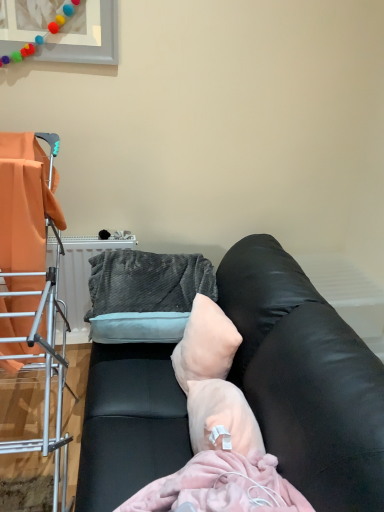
What do you see at coordinates (305, 378) in the screenshot?
I see `black leather couch at center` at bounding box center [305, 378].

You are a GUI agent. You are given a task and a screenshot of the screen. Output one action in this format:
    pyautogui.click(x=<x>, y=<y>)
    Task: Click on the black leather couch at center
    Image resolution: width=384 pixels, height=512 pixels.
    Given the screenshot: What is the action you would take?
    pyautogui.click(x=305, y=378)

The height and width of the screenshot is (512, 384). I want to click on pale pink fabric pillow at center, so click(x=205, y=344).

From a real-world perspective, is pale pink fabric pillow at center on black leather couch at center?

Correct, in the physical world, pale pink fabric pillow at center is higher than black leather couch at center.

Is pale pink fabric pillow at center touching black leather couch at center?

There is a gap between pale pink fabric pillow at center and black leather couch at center.

Could you tell me if pale pink fabric pillow at center is turned towards metal drying rack at left?

Yes, pale pink fabric pillow at center is aimed at metal drying rack at left.

Between pale pink fabric pillow at center and metal drying rack at left, which one has more height?

metal drying rack at left.

Is there a large distance between pale pink fabric pillow at center and metal drying rack at left?

That's not correct — pale pink fabric pillow at center is a little close to metal drying rack at left.

Does pale pink fabric pillow at center have a smaller size compared to metal drying rack at left?

Correct, pale pink fabric pillow at center occupies less space than metal drying rack at left.

From the image's perspective, would you say velvety gray bean bag chair at center is shown under pale pink fabric pillow at center?

No, from the image's perspective, velvety gray bean bag chair at center is not below pale pink fabric pillow at center.

Is pale pink fabric pillow at center at the back of velvety gray bean bag chair at center?

No, velvety gray bean bag chair at center's orientation is not away from pale pink fabric pillow at center.

Looking at the image, does velvety gray bean bag chair at center seem bigger or smaller compared to pale pink fabric pillow at center?

Clearly, velvety gray bean bag chair at center is larger in size than pale pink fabric pillow at center.

In the image, there is a velvety gray bean bag chair at center. At what (x,y) coordinates should I click in order to perform the action: click on pillow below it (from a real-world perspective). Please return your answer as a coordinate pair (x, y). Looking at the image, I should click on (205, 344).

From a real-world perspective, between black leather couch at center and pale pink fabric pillow at center, who is vertically higher?

pale pink fabric pillow at center is physically above.

Is black leather couch at center far away from pale pink fabric pillow at center?

No.

What's the angular difference between black leather couch at center and pale pink fabric pillow at center's facing directions?

15.6 degrees separate the facing orientations of black leather couch at center and pale pink fabric pillow at center.

Does black leather couch at center have a greater width compared to pale pink fabric pillow at center?

Correct, the width of black leather couch at center exceeds that of pale pink fabric pillow at center.

Is velvety gray bean bag chair at center positioned before black leather couch at center?

No, it is not.

How different are the orientations of velvety gray bean bag chair at center and black leather couch at center in degrees?

The facing directions of velvety gray bean bag chair at center and black leather couch at center are 0.000605 degrees apart.

Which of these two, velvety gray bean bag chair at center or black leather couch at center, is thinner?

Thinner between the two is velvety gray bean bag chair at center.

Is velvety gray bean bag chair at center situated inside black leather couch at center or outside?

velvety gray bean bag chair at center is enclosed within black leather couch at center.

Is pale pink fabric pillow at center positioned with its back to velvety gray bean bag chair at center?

pale pink fabric pillow at center does not have its back to velvety gray bean bag chair at center.

Which of these two, pale pink fabric pillow at center or velvety gray bean bag chair at center, stands shorter?

pale pink fabric pillow at center.

From the image's perspective, is pale pink fabric pillow at center located beneath velvety gray bean bag chair at center?

Yes, from the image's perspective, pale pink fabric pillow at center is below velvety gray bean bag chair at center.

What's the angular difference between pale pink fabric pillow at center and velvety gray bean bag chair at center's facing directions?

The angle between the facing direction of pale pink fabric pillow at center and the facing direction of velvety gray bean bag chair at center is 15.6 degrees.

Which point is more forward, (307, 281) or (45, 219)?

The point (45, 219) is in front.

Does black leather couch at center have a lesser width compared to metal drying rack at left?

Incorrect, the width of black leather couch at center is not less than that of metal drying rack at left.

From their relative heights in the image, would you say black leather couch at center is taller or shorter than metal drying rack at left?

In the image, black leather couch at center appears to be shorter than metal drying rack at left.

Based on the photo, which is more to the right, black leather couch at center or metal drying rack at left?

Positioned to the right is black leather couch at center.

I want to click on pillow behind the black leather couch at center, so click(x=205, y=344).

The image size is (384, 512). Identify the location of furniture lying on the left of pale pink fabric pillow at center. pyautogui.click(x=32, y=281).

From the image, which object appears to be nearer to velvety gray bean bag chair at center, pale pink fabric pillow at center or black leather couch at center?

pale pink fabric pillow at center is closer to velvety gray bean bag chair at center.

When comparing their distances from pale pink fabric pillow at center, does metal drying rack at left or velvety gray bean bag chair at center seem further?

metal drying rack at left.

Looking at the image, which one is located further to pale pink fabric pillow at center, velvety gray bean bag chair at center or metal drying rack at left?

Among the two, metal drying rack at left is located further to pale pink fabric pillow at center.

Estimate the real-world distances between objects in this image. Which object is further from black leather couch at center, velvety gray bean bag chair at center or metal drying rack at left?

metal drying rack at left lies further to black leather couch at center than the other object.

When comparing their distances from metal drying rack at left, does velvety gray bean bag chair at center or black leather couch at center seem closer?

velvety gray bean bag chair at center is positioned closer to the anchor metal drying rack at left.

Looking at the image, which one is located closer to black leather couch at center, pale pink fabric pillow at center or metal drying rack at left?

pale pink fabric pillow at center.

Consider the image. Looking at the image, which one is located closer to black leather couch at center, metal drying rack at left or velvety gray bean bag chair at center?

The object closer to black leather couch at center is velvety gray bean bag chair at center.

Based on their spatial positions, is black leather couch at center or velvety gray bean bag chair at center further from metal drying rack at left?

black leather couch at center is positioned further to the anchor metal drying rack at left.

Where is `pillow positioned between black leather couch at center and velvety gray bean bag chair at center from near to far`? The height and width of the screenshot is (512, 384). pillow positioned between black leather couch at center and velvety gray bean bag chair at center from near to far is located at coordinates (205, 344).

Where is `pillow between metal drying rack at left and velvety gray bean bag chair at center from front to back`? The height and width of the screenshot is (512, 384). pillow between metal drying rack at left and velvety gray bean bag chair at center from front to back is located at coordinates (205, 344).

The image size is (384, 512). I want to click on furniture between black leather couch at center and pale pink fabric pillow at center from front to back, so click(32, 281).

You are a GUI agent. You are given a task and a screenshot of the screen. Output one action in this format:
    pyautogui.click(x=<x>, y=<y>)
    Task: Click on the furniture between black leather couch at center and velvety gray bean bag chair at center from front to back
    Image resolution: width=384 pixels, height=512 pixels.
    Given the screenshot: What is the action you would take?
    pyautogui.click(x=32, y=281)